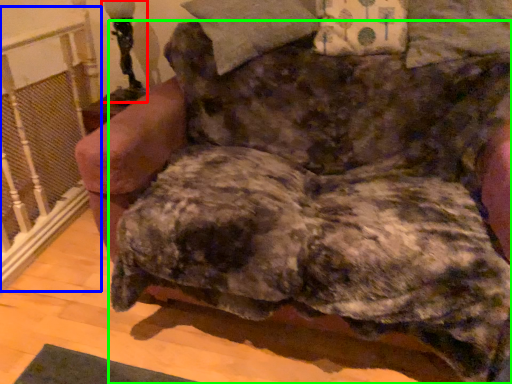
Question: Which object is positioned farthest from table lamp (highlighted by a red box)? Select from rail (highlighted by a blue box) and dog (highlighted by a green box).

Choices:
 (A) rail
 (B) dog

Answer: (B)